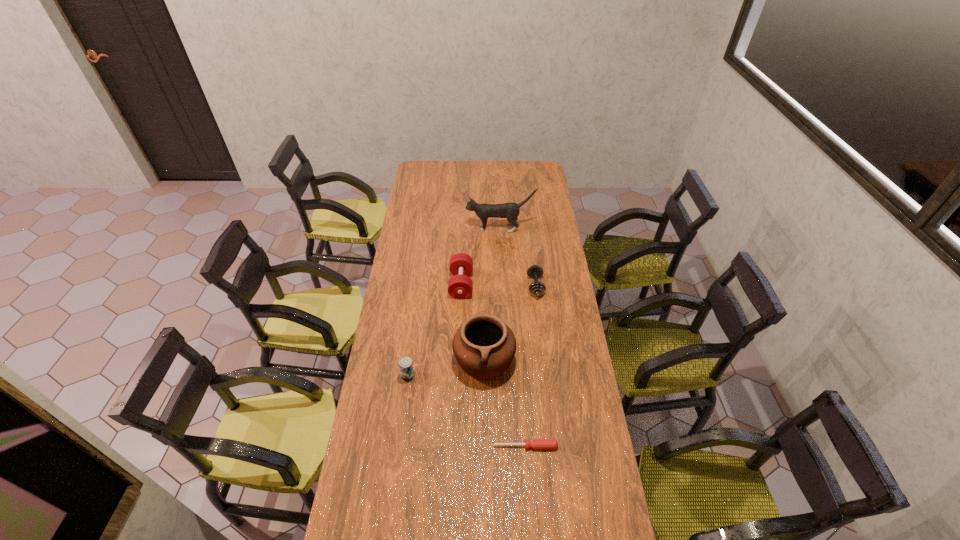
Locate an element on the screen. free space located at the face of the cat is located at coordinates (432, 228).

Locate an element on the screen. free spot located 0.170m at the face of the cat is located at coordinates (436, 228).

I want to click on vacant space located 0.290m on the back of the fifth shortest object, so click(x=484, y=288).

Find the location of `free spot located 0.400m on the front of the taller dumbbell`. free spot located 0.400m on the front of the taller dumbbell is located at coordinates (457, 374).

This screenshot has width=960, height=540. In order to click on blank area located 0.250m on the right of the beer can in this screenshot , I will do `click(476, 376)`.

The height and width of the screenshot is (540, 960). Identify the location of vacant space located on the back of the right dumbbell. (532, 260).

Identify the location of free space located 0.180m on the back of the nearest object. pyautogui.click(x=522, y=397).

Identify the location of object that is at the left edge. This screenshot has width=960, height=540. (405, 363).

This screenshot has width=960, height=540. Find the location of `cat at the right edge`. cat at the right edge is located at coordinates (510, 210).

Find the location of `dumbbell that is positioned at the right edge`. dumbbell that is positioned at the right edge is located at coordinates (536, 288).